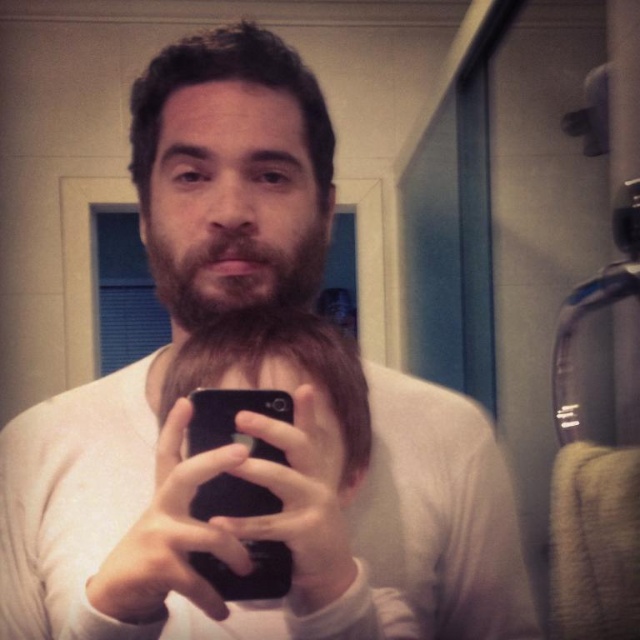
You are trying to take a selfie in a bathroom. You have a brownwoollybeard at center and a black matte smartphone at center. Which object is located higher up in the image?

The brownwoollybeard at center is positioned over the black matte smartphone at center, so the brownwoollybeard at center is higher up in the image.

You are a photographer trying to capture a clear selfie. You notice the black matte phone at center and the brownwoollybeard at center. Which object is closer to the camera lens?

The black matte phone at center is closer to the camera lens since it is positioned in front of the brownwoollybeard at center.